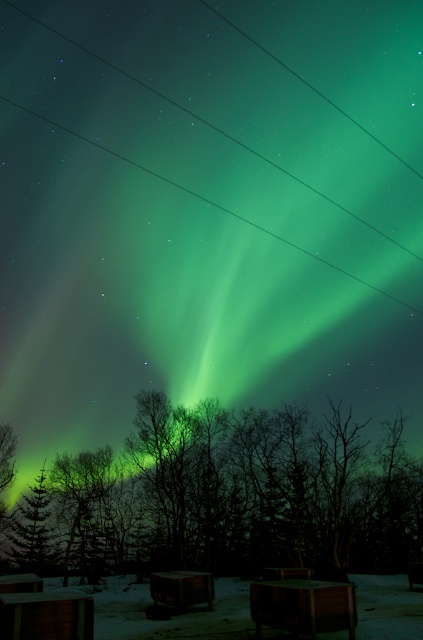
You are standing in the snowy area looking at the Northern Lights. There are two points marked in the scene. Which point is closer to you, the point at coordinates point (x=321, y=536) or the point at coordinates point (x=27, y=513)?

The point at coordinates point (x=321, y=536) is closer to you than the point at coordinates point (x=27, y=513).